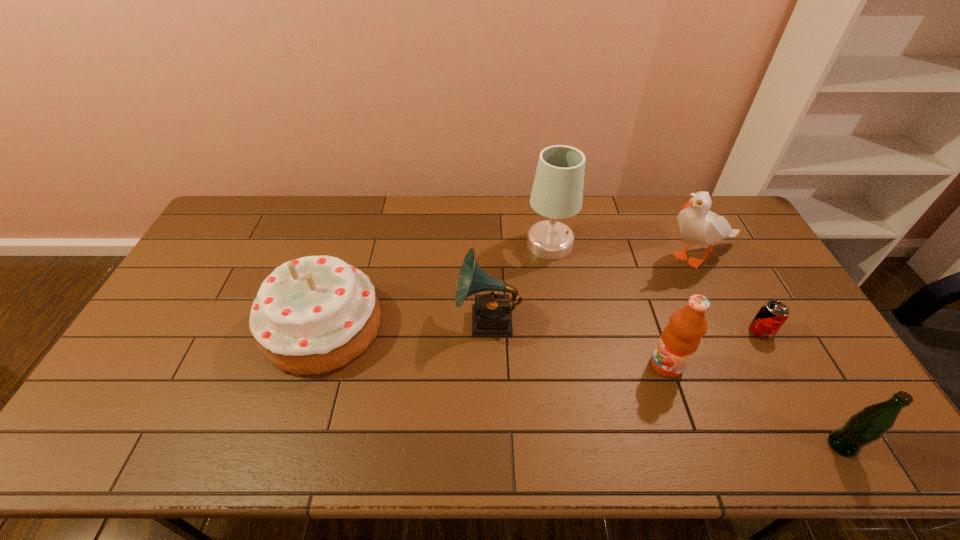
Where is `the third object from left to right`? the third object from left to right is located at coordinates (557, 193).

The image size is (960, 540). Find the location of `lampshade`. lampshade is located at coordinates (557, 193).

Where is `gull`? gull is located at coordinates (698, 226).

Where is `the fourth object from right to left`? the fourth object from right to left is located at coordinates (680, 339).

The width and height of the screenshot is (960, 540). I want to click on phonograph_record, so click(491, 314).

At what (x,y) coordinates should I click in order to perform the action: click on cake. Please return your answer as a coordinate pair (x, y). This screenshot has width=960, height=540. Looking at the image, I should click on (312, 315).

Where is `the nearest object`? the nearest object is located at coordinates (868, 425).

Locate an element on the screen. This screenshot has width=960, height=540. soda can is located at coordinates (772, 315).

This screenshot has height=540, width=960. Identify the location of vacant region located 0.310m on the base of the fifth object from right to left. (564, 336).

The image size is (960, 540). I want to click on free space located at the beak of the gull, so click(x=623, y=258).